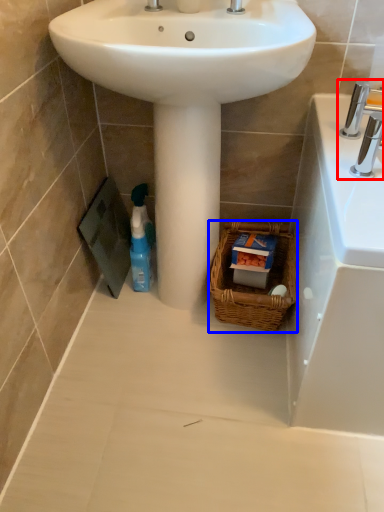
Question: Which object appears closest to the camera in this image, tap (highlighted by a red box) or basket (highlighted by a blue box)?

Choices:
 (A) tap
 (B) basket

Answer: (A)